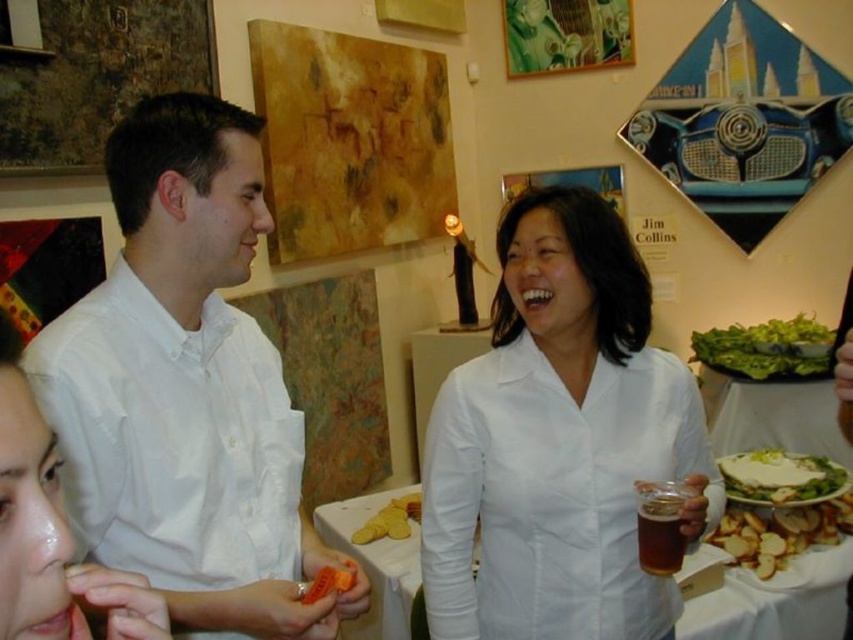
Please describe the location of the brown crumbly bread at lower right in the image using coordinates.

The brown crumbly bread at lower right is located at coordinates point (780,532).

You are at a party and want to grab a drink and a snack. You see the brown crumbly bread at lower right and the brown glass beer at center. Which item is located to the right of the other?

The brown crumbly bread at lower right is to the right of the brown glass beer at center.